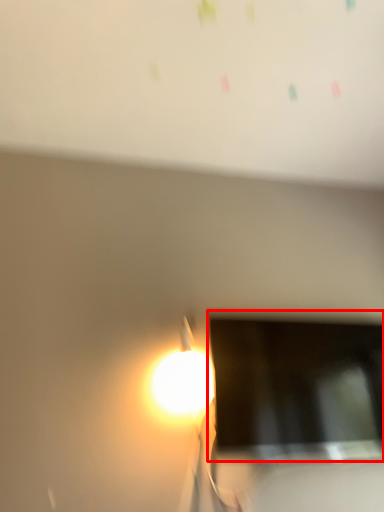
Question: From the image's perspective, where is computer screen (annotated by the red box) located relative to bulletin board?

Choices:
 (A) above
 (B) below

Answer: (B)